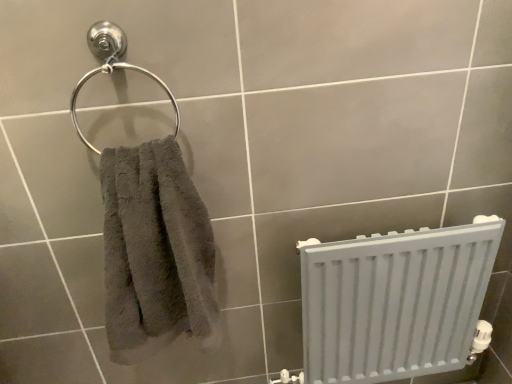
Question: Does satin chrome towel ring at upper left touch white matte radiator at lower right?

Choices:
 (A) no
 (B) yes

Answer: (A)

Question: From a real-world perspective, is satin chrome towel ring at upper left positioned over white matte radiator at lower right based on gravity?

Choices:
 (A) yes
 (B) no

Answer: (A)

Question: Can you confirm if satin chrome towel ring at upper left is positioned to the left of white matte radiator at lower right?

Choices:
 (A) yes
 (B) no

Answer: (A)

Question: Is satin chrome towel ring at upper left turned away from white matte radiator at lower right?

Choices:
 (A) no
 (B) yes

Answer: (A)

Question: Considering the relative sizes of satin chrome towel ring at upper left and white matte radiator at lower right in the image provided, is satin chrome towel ring at upper left shorter than white matte radiator at lower right?

Choices:
 (A) no
 (B) yes

Answer: (B)

Question: In terms of height, does gray fluffy towel at left look taller or shorter compared to satin chrome towel ring at upper left?

Choices:
 (A) short
 (B) tall

Answer: (B)

Question: Is gray fluffy towel at left inside the boundaries of satin chrome towel ring at upper left, or outside?

Choices:
 (A) inside
 (B) outside

Answer: (B)

Question: In the image, is gray fluffy towel at left on the left side or the right side of satin chrome towel ring at upper left?

Choices:
 (A) left
 (B) right

Answer: (B)

Question: From a real-world perspective, relative to satin chrome towel ring at upper left, is gray fluffy towel at left vertically above or below?

Choices:
 (A) below
 (B) above

Answer: (A)

Question: Is white matte radiator at lower right bigger or smaller than gray fluffy towel at left?

Choices:
 (A) big
 (B) small

Answer: (A)

Question: In the image, is white matte radiator at lower right positioned in front of or behind gray fluffy towel at left?

Choices:
 (A) behind
 (B) front

Answer: (A)

Question: In the image, is white matte radiator at lower right on the left side or the right side of gray fluffy towel at left?

Choices:
 (A) right
 (B) left

Answer: (A)

Question: From the image's perspective, is white matte radiator at lower right located above or below gray fluffy towel at left?

Choices:
 (A) above
 (B) below

Answer: (B)

Question: Is white matte radiator at lower right taller or shorter than satin chrome towel ring at upper left?

Choices:
 (A) short
 (B) tall

Answer: (B)

Question: Is white matte radiator at lower right wider or thinner than satin chrome towel ring at upper left?

Choices:
 (A) thin
 (B) wide

Answer: (B)